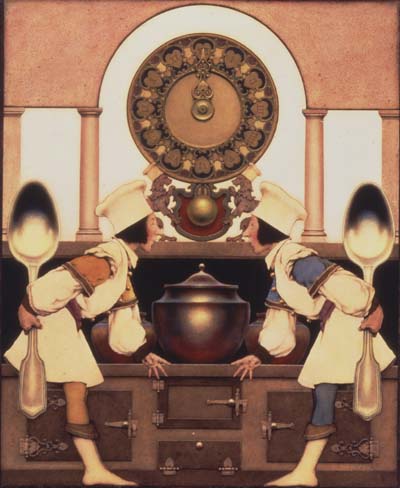
Find the location of a particular element. latch is located at coordinates (221, 400).